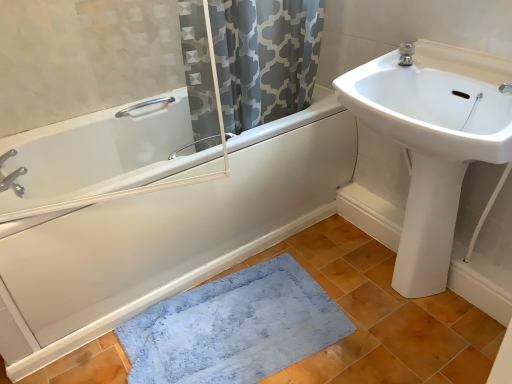
Find the location of a particular element. This screenshot has width=512, height=384. vacant space situated on the left part of satin nickel faucet at upper right, positioned as the 2th tap in bottom-to-top order is located at coordinates click(373, 68).